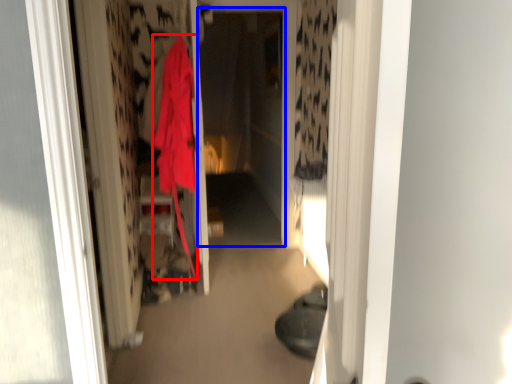
Question: Which object appears farthest to the camera in this image, cloak (highlighted by a red box) or screen door (highlighted by a blue box)?

Choices:
 (A) cloak
 (B) screen door

Answer: (B)